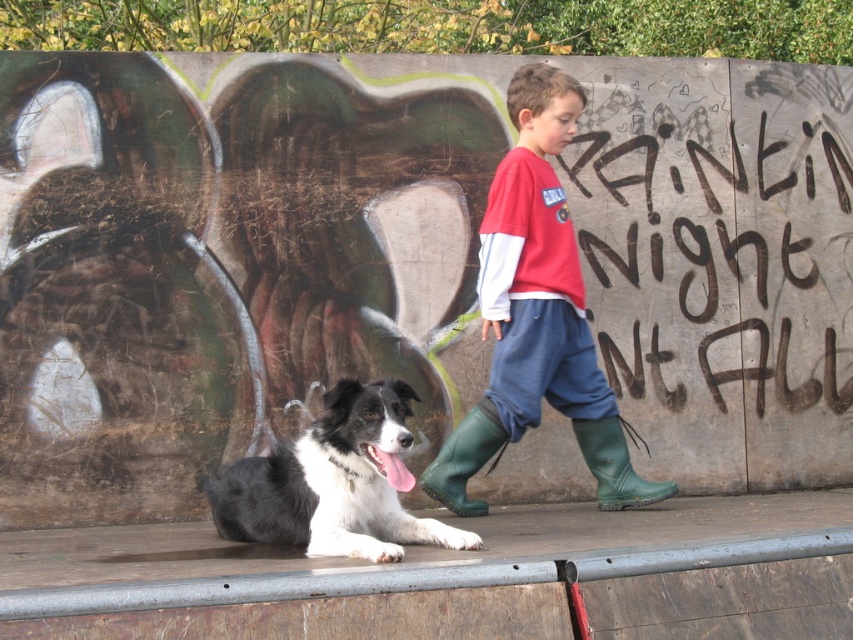
You are a photographer trying to capture the black and white fur at lower left and the green rubber boot at lower right in the same frame. Based on their sizes, which object should you focus on first to ensure both are in clear view?

The black and white fur at lower left is bigger than the green rubber boot at lower right, so you should focus on the black and white fur at lower left first to ensure both are in clear view.

You are a photographer trying to capture the black and white fur at lower left and the green rubber boot at lower center in the same frame. Which object should you focus on first to ensure both are in the frame?

The black and white fur at lower left has a larger width than the green rubber boot at lower center, so focusing on the black and white fur at lower left first would help ensure both objects fit within the frame.

The young boy is walking and looking down. He notices two things on the ground near his feet. What is the position of the black and white fur at lower left relative to the green rubber boot at lower center?

The black and white fur at lower left is below the green rubber boot at lower center.